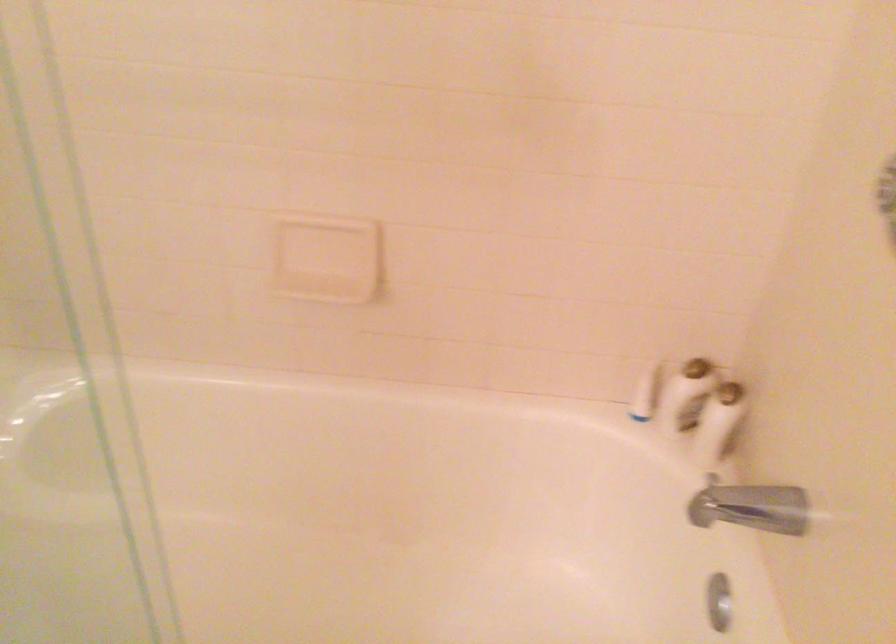
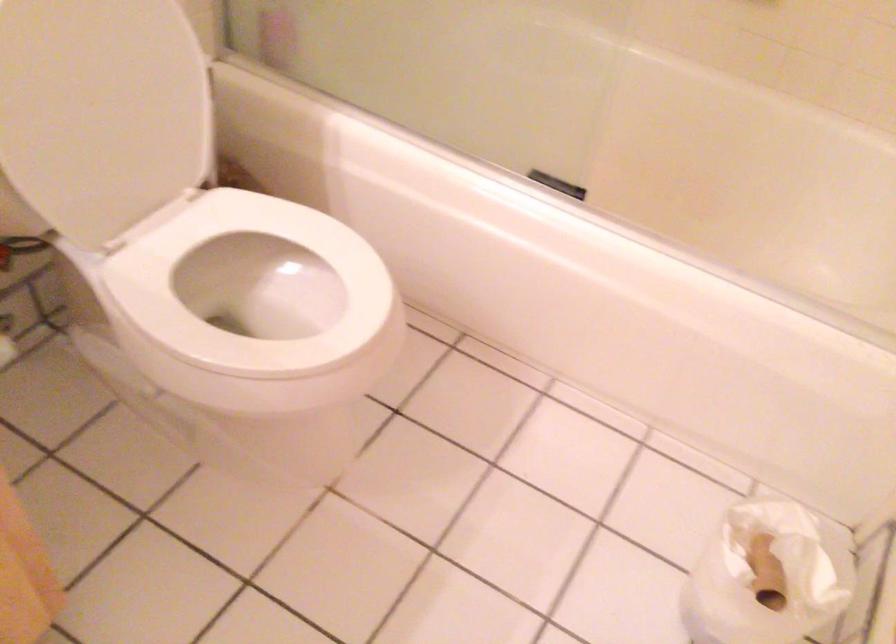
Question: The camera is either moving clockwise (left) or counter-clockwise (right) around the object. The first image is from the beginning of the video and the second image is from the end. Is the camera moving left or right when shooting the video?

Choices:
 (A) Left
 (B) Right

Answer: (B)